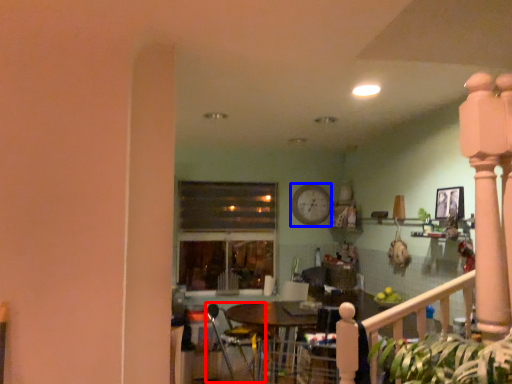
Question: Which point is further to the camera, armchair (highlighted by a red box) or clock (highlighted by a blue box)?

Choices:
 (A) armchair
 (B) clock

Answer: (B)